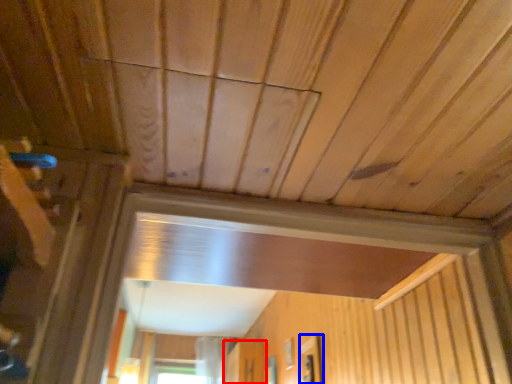
Question: Which of the following is the farthest to the observer, screen door (highlighted by a red box) or window (highlighted by a blue box)?

Choices:
 (A) screen door
 (B) window

Answer: (A)